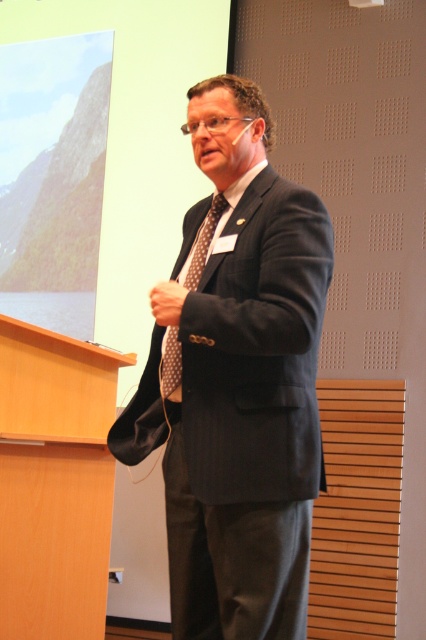
You are an event organizer and need to ensure the speaker is properly dressed for the event. Based on the image, is the brown dotted tie at center positioned correctly relative to the matte black suit at center?

The brown dotted tie at center is positioned above the matte black suit at center, which is the correct placement for a tie relative to a suit.

You are an event organizer who needs to place a small microphone stand in the scene. The stand must be positioned exactly at point (236, 380). Will placing the microphone stand at this point interfere with the matte black suit at center?

The matte black suit at center is located at point (236, 380), so placing the microphone stand at this point will directly interfere with the matte black suit at center as they occupy the same coordinates.